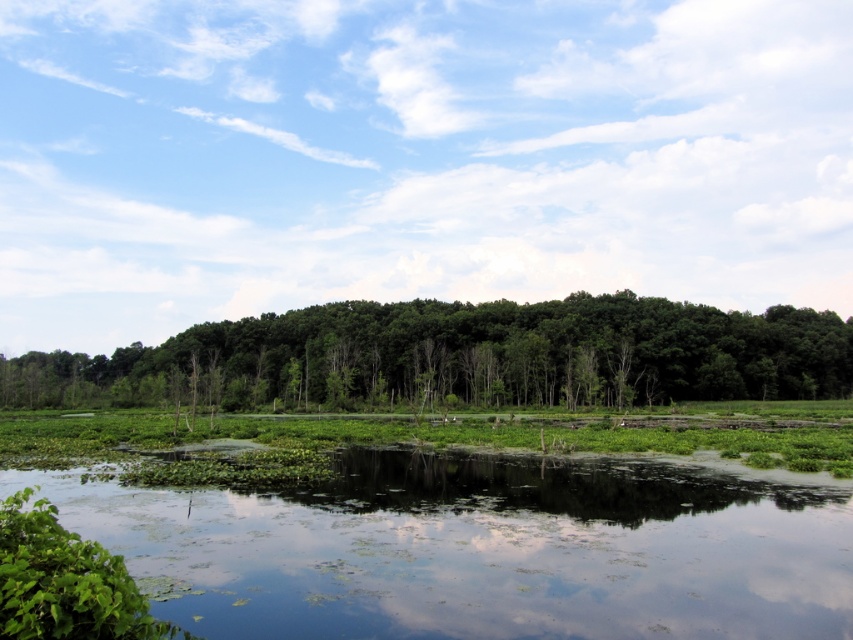
Based on the photo, you are standing at the center of the image and want to reach the green leafy water at bottom. In which direction should you move to get there?

The green leafy water at bottom is located at point 0.858 on the x axis and 0.567 on the y axis. Since you are at the center, you should move towards the lower right direction to reach it.

You are standing at the edge of the water and see the green leafy water at bottom and the green leafy trees at center. Which one is more to the right side?

The green leafy water at bottom is positioned on the right side of green leafy trees at center, so the green leafy water at bottom is more to the right side.